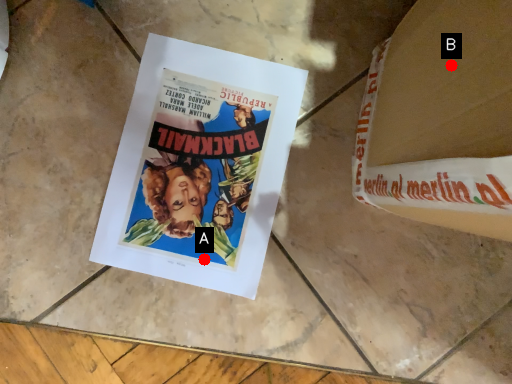
Question: Two points are circled on the image, labeled by A and B beside each circle. Which point is closer to the camera?

Choices:
 (A) A is closer
 (B) B is closer

Answer: (B)